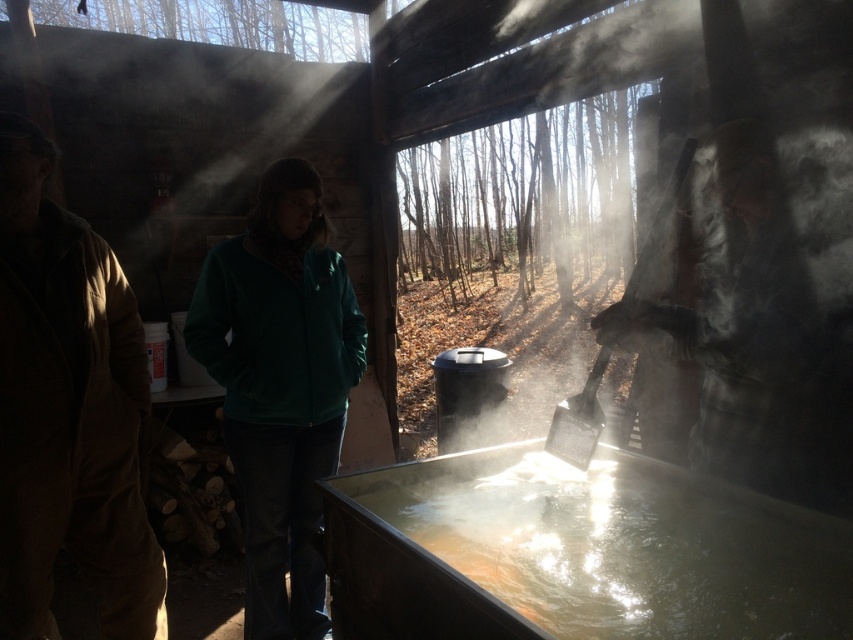
Who is positioned more to the right, translucent metallic water at center or green matte jacket at center?

Positioned to the right is translucent metallic water at center.

Is translucent metallic water at center taller than green matte jacket at center?

No, translucent metallic water at center is not taller than green matte jacket at center.

In order to click on translucent metallic water at center in this screenshot , I will do `click(576, 552)`.

Is brown corduroy jacket at left below green matte jacket at center?

No.

Based on the photo, is brown corduroy jacket at left wider than green matte jacket at center?

No, brown corduroy jacket at left is not wider than green matte jacket at center.

Which is in front, point (80, 545) or point (277, 358)?

Positioned in front is point (80, 545).

You are a GUI agent. You are given a task and a screenshot of the screen. Output one action in this format:
    pyautogui.click(x=<x>, y=<y>)
    Task: Click on the brown corduroy jacket at left
    This screenshot has height=640, width=853.
    Given the screenshot: What is the action you would take?
    pyautogui.click(x=68, y=410)

How far apart are translucent metallic water at center and brown corduroy jacket at left?

1.20 meters

Is point (389, 612) less distant than point (140, 372)?

Yes, point (389, 612) is closer to viewer.

Locate an element on the screen. The image size is (853, 640). translucent metallic water at center is located at coordinates pos(576,552).

What are the coordinates of `translucent metallic water at center` in the screenshot? It's located at (576, 552).